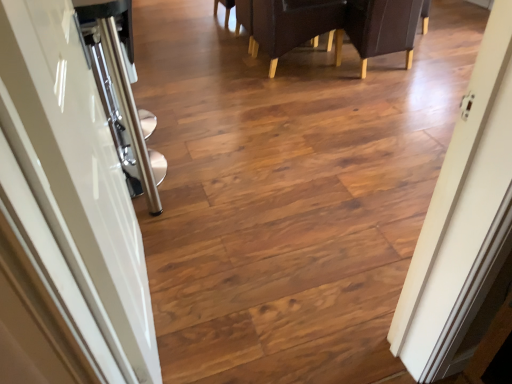
Question: Considering the relative positions of glossy white door at left and leather-like dark brown chair at upper center in the image provided, is glossy white door at left to the left of leather-like dark brown chair at upper center from the viewer's perspective?

Choices:
 (A) yes
 (B) no

Answer: (A)

Question: From the image's perspective, is glossy white door at left located beneath leather-like dark brown chair at upper center?

Choices:
 (A) no
 (B) yes

Answer: (B)

Question: Considering the relative sizes of glossy white door at left and leather-like dark brown chair at upper center in the image provided, is glossy white door at left shorter than leather-like dark brown chair at upper center?

Choices:
 (A) no
 (B) yes

Answer: (A)

Question: Could leather-like dark brown chair at upper center be considered to be inside glossy white door at left?

Choices:
 (A) yes
 (B) no

Answer: (B)

Question: Is glossy white door at left taller than leather-like dark brown chair at upper center?

Choices:
 (A) no
 (B) yes

Answer: (B)

Question: In terms of width, does glossy white door at left look wider or thinner when compared to dark brown leather armchair at upper right, the second armchair from the left?

Choices:
 (A) wide
 (B) thin

Answer: (B)

Question: Would you say glossy white door at left is inside or outside dark brown leather armchair at upper right, the second armchair from the left?

Choices:
 (A) inside
 (B) outside

Answer: (B)

Question: From the image's perspective, is glossy white door at left above or below dark brown leather armchair at upper right, the second armchair from the left?

Choices:
 (A) below
 (B) above

Answer: (A)

Question: Based on their positions, is glossy white door at left located to the left or right of dark brown leather armchair at upper right, the second armchair from the left?

Choices:
 (A) left
 (B) right

Answer: (A)

Question: From the image's perspective, relative to leather-like dark brown chair at upper center, is dark brown leather armchair at upper right, the second armchair from the left, above or below?

Choices:
 (A) above
 (B) below

Answer: (B)

Question: Is point (385, 3) positioned closer to the camera than point (400, 46)?

Choices:
 (A) closer
 (B) farther

Answer: (A)

Question: Considering the relative positions of dark brown leather armchair at upper right, the second armchair from the left, and leather-like dark brown chair at upper center in the image provided, is dark brown leather armchair at upper right, the second armchair from the left, to the left or to the right of leather-like dark brown chair at upper center?

Choices:
 (A) left
 (B) right

Answer: (B)

Question: In terms of size, does dark brown leather armchair at upper right, the second armchair from the left, appear bigger or smaller than leather-like dark brown chair at upper center?

Choices:
 (A) small
 (B) big

Answer: (A)

Question: From a real-world perspective, is glossy white door at left positioned above or below leather-like dark brown chair at upper center?

Choices:
 (A) below
 (B) above

Answer: (B)

Question: Is glossy white door at left inside the boundaries of leather-like dark brown chair at upper center, or outside?

Choices:
 (A) inside
 (B) outside

Answer: (B)